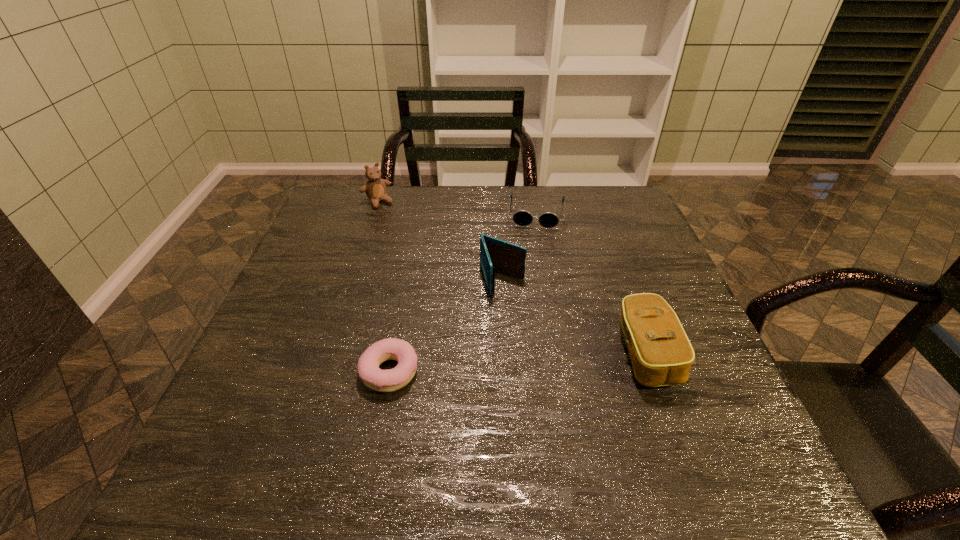
This screenshot has height=540, width=960. Find the location of `vacant area that lies between the rightmost object and the second object from left to right`. vacant area that lies between the rightmost object and the second object from left to right is located at coordinates (517, 362).

You are a GUI agent. You are given a task and a screenshot of the screen. Output one action in this format:
    pyautogui.click(x=<x>, y=<y>)
    Task: Click on the free spot between the teddy bear and the wallet
    
    Given the screenshot: What is the action you would take?
    pyautogui.click(x=440, y=241)

Find the location of a particular element. The width and height of the screenshot is (960, 540). empty location between the second object from left to right and the sunglasses is located at coordinates (463, 292).

In order to click on free space between the teddy bear and the clutch bag in this screenshot , I will do `click(512, 278)`.

Locate an element on the screen. This screenshot has width=960, height=540. vacant region between the shortest object and the teddy bear is located at coordinates (384, 287).

I want to click on unoccupied position between the rightmost object and the third farthest object, so click(574, 317).

You are a GUI agent. You are given a task and a screenshot of the screen. Output one action in this format:
    pyautogui.click(x=<x>, y=<y>)
    Task: Click on the empty location between the leftmost object and the clutch bag
    The image size is (960, 540).
    Given the screenshot: What is the action you would take?
    pyautogui.click(x=512, y=278)

You are a GUI agent. You are given a task and a screenshot of the screen. Output one action in this format:
    pyautogui.click(x=<x>, y=<y>)
    Task: Click on the fourth closest object to the leftmost object
    This screenshot has height=540, width=960.
    Given the screenshot: What is the action you would take?
    pyautogui.click(x=661, y=354)

This screenshot has height=540, width=960. Find the location of `the second closest object relative to the shortest object`. the second closest object relative to the shortest object is located at coordinates (661, 354).

Image resolution: width=960 pixels, height=540 pixels. What are the coordinates of `vacant space that satisfies the following two spatial constraints: 1. on the front side of the leftmost object; 2. on the left side of the wallet` in the screenshot? It's located at (352, 281).